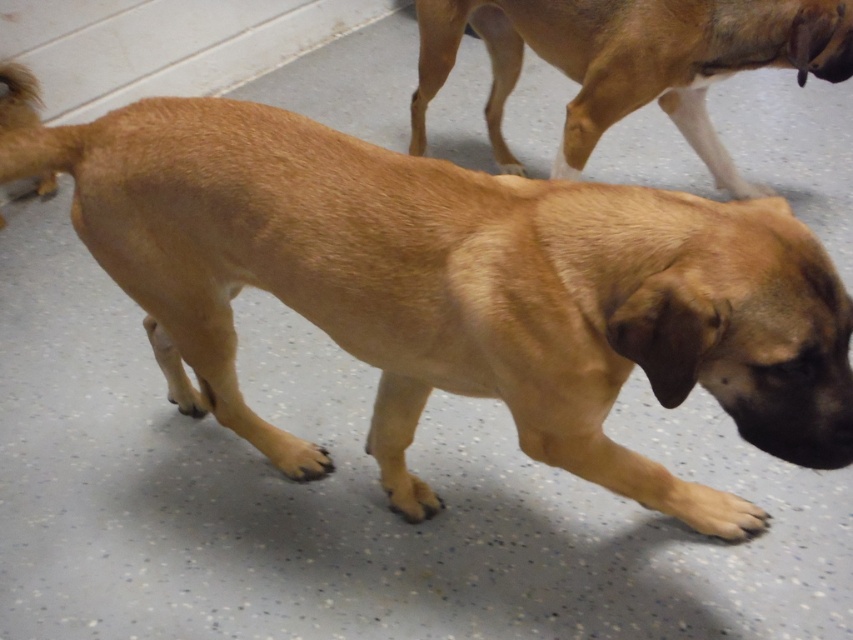
Question: Which point is closer to the camera taking this photo?

Choices:
 (A) (369, 182)
 (B) (654, 56)

Answer: (A)

Question: Is brown fur dog at center smaller than brown furry dog at upper right?

Choices:
 (A) yes
 (B) no

Answer: (B)

Question: Is brown fur dog at center above brown furry dog at upper right?

Choices:
 (A) no
 (B) yes

Answer: (A)

Question: Among these objects, which one is nearest to the camera?

Choices:
 (A) brown fur dog at center
 (B) brown furry dog at upper right

Answer: (A)

Question: In this image, where is brown fur dog at center located relative to brown furry dog at upper right?

Choices:
 (A) below
 (B) above

Answer: (A)